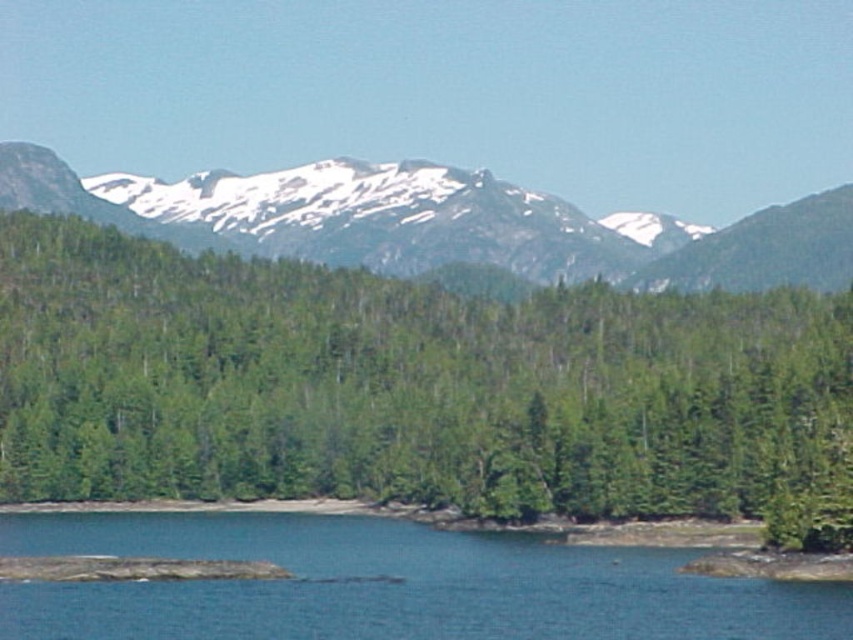
You are standing at the center of the image and want to walk towards the green matte tree at center. In which direction should you move relative to your current position?

Since the green matte tree at center is located at point coordinates, you should move directly forward to reach it as it is centered in your view.

You are an environmental scientist assessing the landscape. You need to determine which object has a smaller width between the green matte tree at center and the snowy granite mountain range at upper center. Which one is it?

The green matte tree at center is thinner than the snowy granite mountain range at upper center, so the green matte tree at center has a smaller width.

You are standing at the center of the image and want to locate the blue water at lower center. According to the coordinates provided, in which direction should you move to reach it?

The blue water at lower center is located at coordinates point (392, 586). Since you are at the center, moving downward and to the right would lead you to the blue water at lower center.